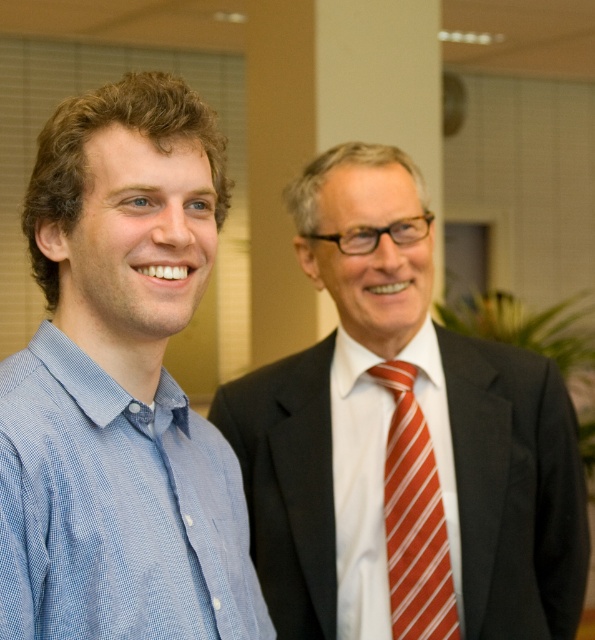
You are an office receptionist who needs to guide a visitor to the conference room. The visitor is wearing a blue checkered shirt at left and a red striped tie at center. Which clothing item should the receptionist point to in order to correctly identify the visitor?

The blue checkered shirt at left is positioned over the red striped tie at center, so the receptionist should point to the blue checkered shirt at left to correctly identify the visitor.

You are organizing a photo shoot and need to ensure proper lighting for the subjects. Given the positions of the matte black suit at right and the red striped tie at center, which object is closer to the camera?

The matte black suit at right is closer to the camera than the red striped tie at center because the tie is positioned behind the suit.